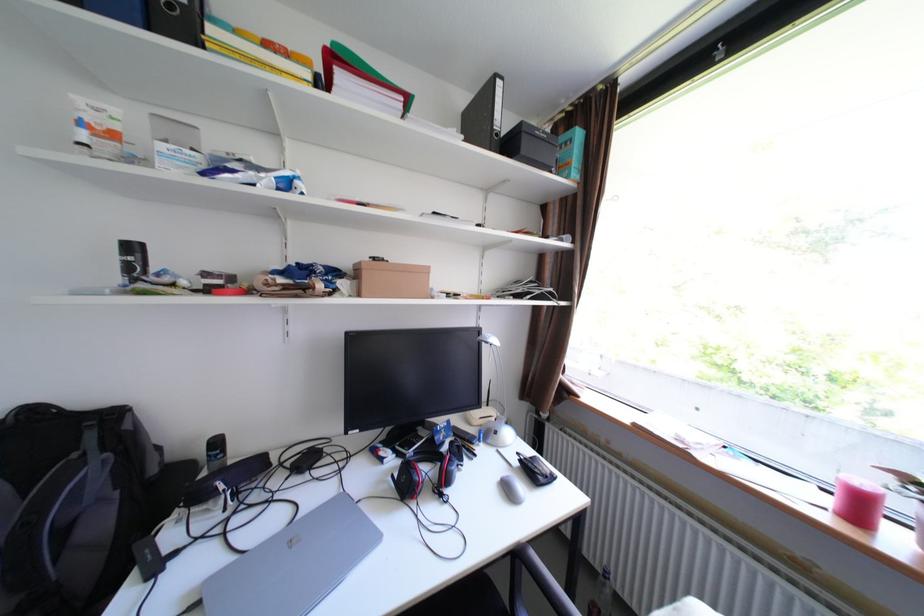
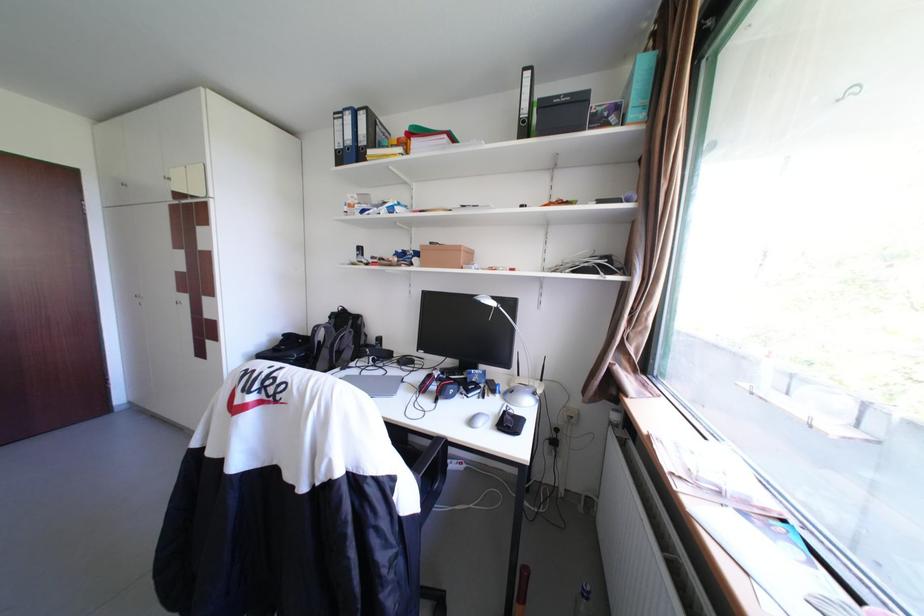
Find the pixel in the second image that matches [507,135] in the first image.

(535, 122)